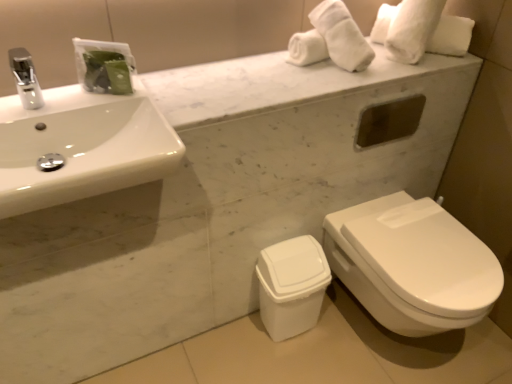
The image size is (512, 384). In order to click on free spot below white glossy toilet at lower right (from a real-world perspective) in this screenshot , I will do `click(387, 339)`.